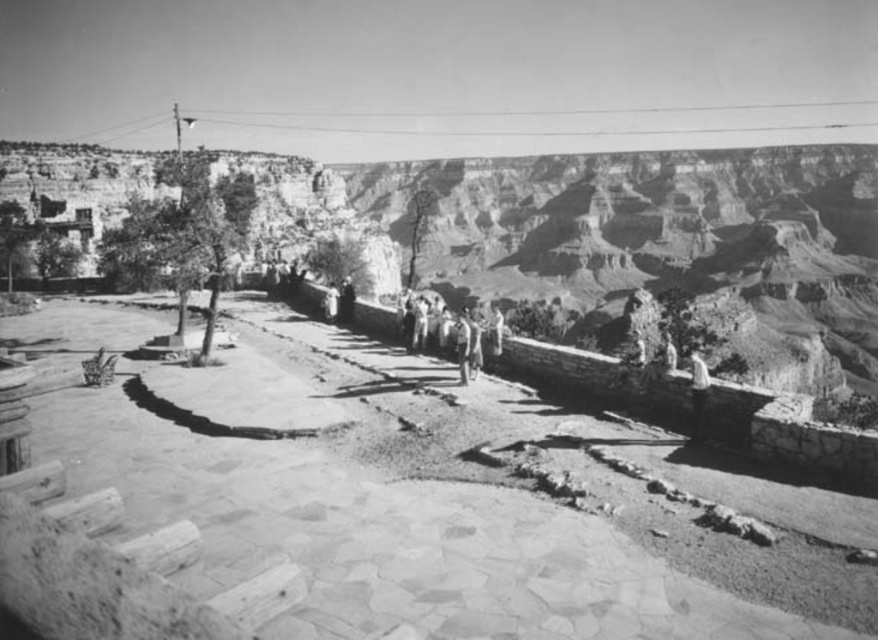
Question: Among these objects, which one is nearest to the camera?

Choices:
 (A) light beige stone person at center
 (B) light gray fabric shirt at upper right
 (C) smooth skin person at center

Answer: (B)

Question: Which object is the farthest from the smooth skin person at center?

Choices:
 (A) light beige stone person at center
 (B) light gray fabric shirt at upper right

Answer: (B)

Question: Can you confirm if light gray fabric shirt at upper right is smaller than light beige stone person at center?

Choices:
 (A) yes
 (B) no

Answer: (A)

Question: Among these objects, which one is nearest to the camera?

Choices:
 (A) smooth skin person at center
 (B) light beige stone person at center
 (C) light gray fabric shirt at upper right

Answer: (C)

Question: Is light gray fabric shirt at upper right to the right of light beige stone person at center from the viewer's perspective?

Choices:
 (A) no
 (B) yes

Answer: (A)

Question: In this image, where is light beige stone person at center located relative to smooth skin person at center?

Choices:
 (A) left
 (B) right

Answer: (B)